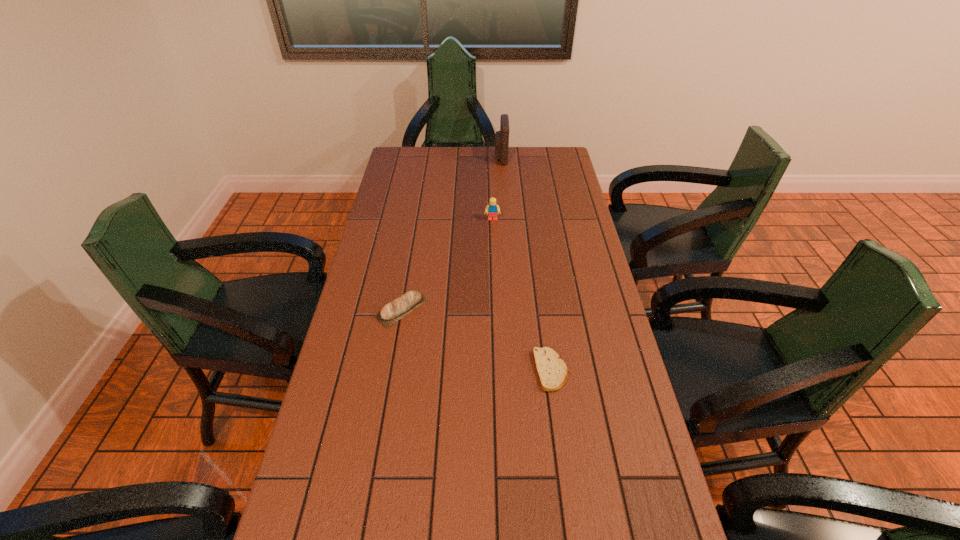
The height and width of the screenshot is (540, 960). Find the location of `pouch`. pouch is located at coordinates (501, 137).

Identify the location of the farthest object. The height and width of the screenshot is (540, 960). (501, 137).

The width and height of the screenshot is (960, 540). What are the coordinates of `the third shortest object` in the screenshot? It's located at (492, 209).

Find the location of a particular element. the third nearest object is located at coordinates (492, 209).

Where is `the left pita bread`? The height and width of the screenshot is (540, 960). the left pita bread is located at coordinates (392, 312).

The image size is (960, 540). I want to click on the leftmost object, so click(x=392, y=312).

Image resolution: width=960 pixels, height=540 pixels. I want to click on the nearest object, so click(x=552, y=372).

Where is `the nearer pita bread`? the nearer pita bread is located at coordinates (552, 372).

Find the location of a particular element. The width and height of the screenshot is (960, 540). blank space located 0.250m with an open flap on the farthest object is located at coordinates (439, 158).

Identify the location of free location located with an open flap on the farthest object. (411, 158).